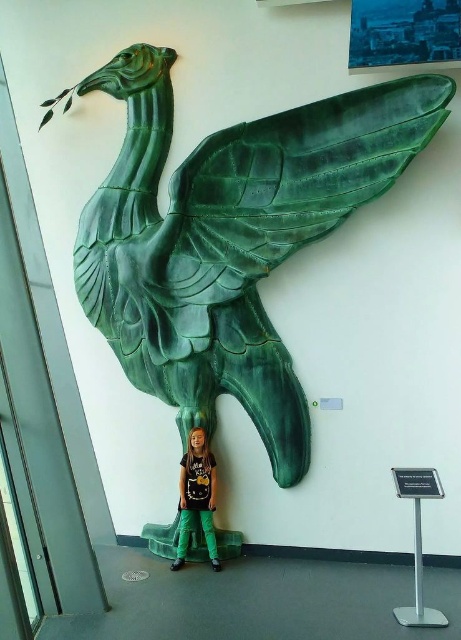
Does green glossy bird at upper center have a lesser width compared to matte green pants at lower center?

No, green glossy bird at upper center is not thinner than matte green pants at lower center.

How distant is green glossy bird at upper center from matte green pants at lower center?

27.66 inches

The height and width of the screenshot is (640, 461). I want to click on green glossy bird at upper center, so click(229, 236).